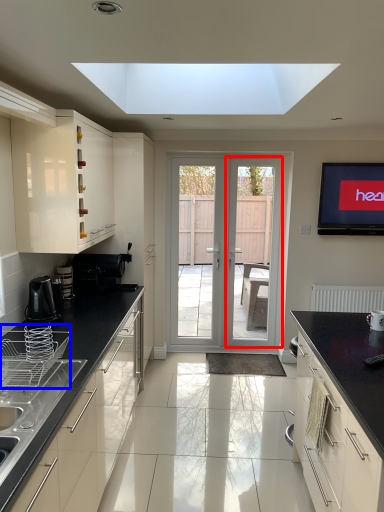
Question: Which object appears closest to the camera in this image, screen door (highlighted by a red box) or appliance (highlighted by a blue box)?

Choices:
 (A) screen door
 (B) appliance

Answer: (B)